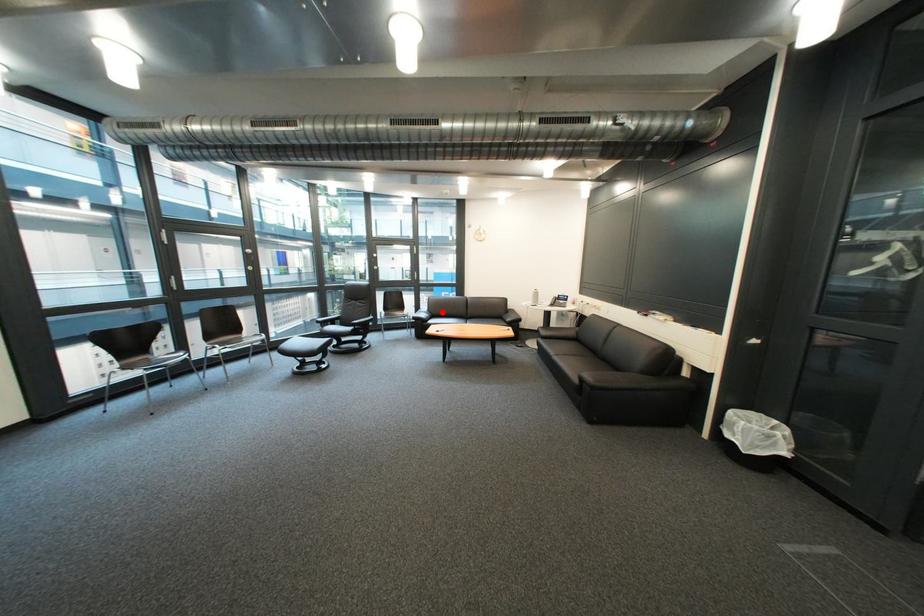
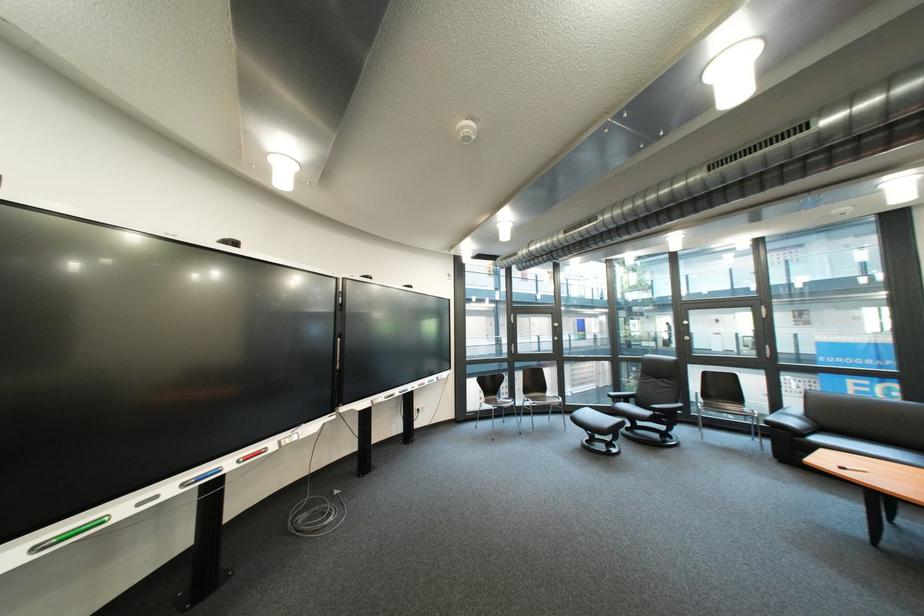
Find the pixel in the second image that matches the highlighted location in the first image.

(822, 418)